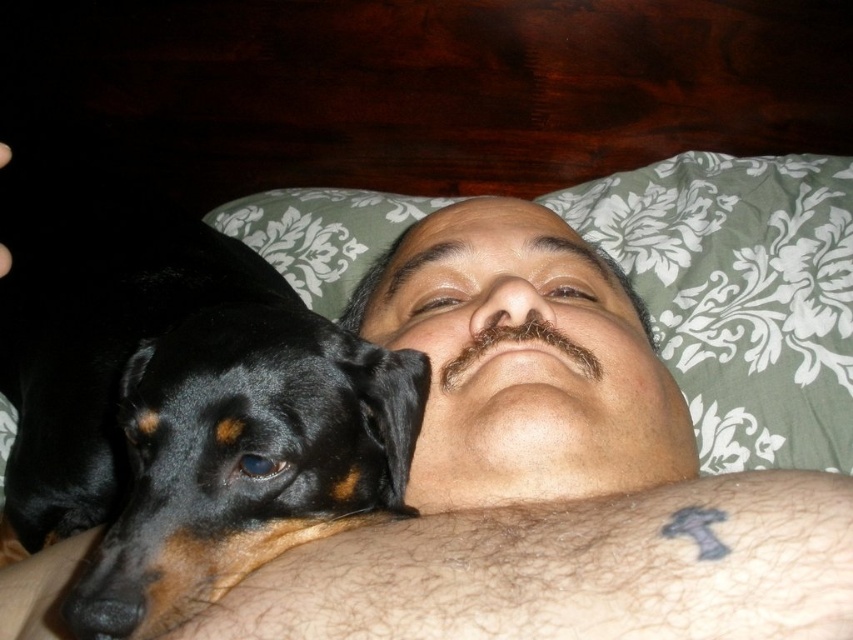
Question: Which point is closer to the camera taking this photo?

Choices:
 (A) (372, 483)
 (B) (631, 198)

Answer: (A)

Question: Is black shiny dog at left to the right of green floral pillow at upper center from the viewer's perspective?

Choices:
 (A) yes
 (B) no

Answer: (B)

Question: Among these objects, which one is nearest to the camera?

Choices:
 (A) black shiny dog at left
 (B) green floral pillow at upper center

Answer: (A)

Question: Is the position of black shiny dog at left less distant than that of green floral pillow at upper center?

Choices:
 (A) no
 (B) yes

Answer: (B)

Question: Is black shiny dog at left to the left of green floral pillow at upper center from the viewer's perspective?

Choices:
 (A) yes
 (B) no

Answer: (A)